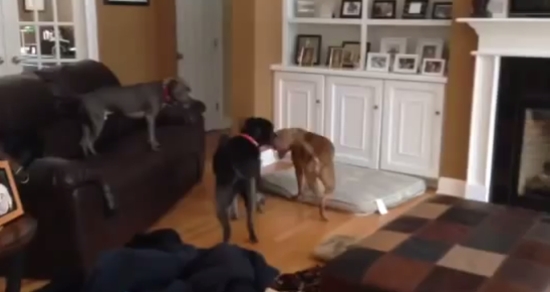
I want to click on light brown painted wall, so click(134, 20), click(134, 65), click(262, 100), click(267, 14), click(242, 16), click(242, 97), click(463, 58), click(453, 155), click(460, 6).